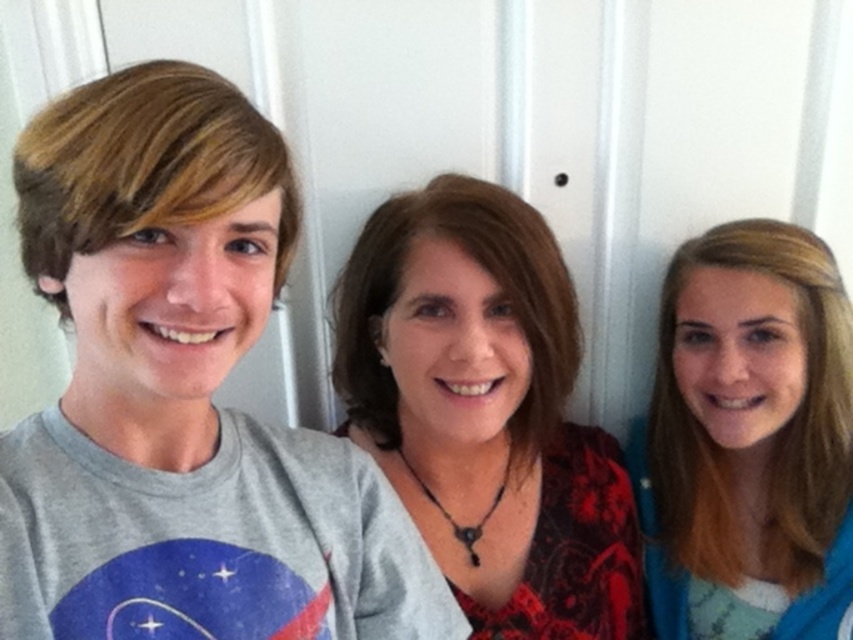
Looking at this image, you are standing in front of a group of three people against a white wall. You need to take a photo of the point at coordinates point (x=358, y=429). Can you tell me if this point is within the camera frame?

The point (x=358, y=429) is 1.14 meters from the camera, so it is within the camera frame.